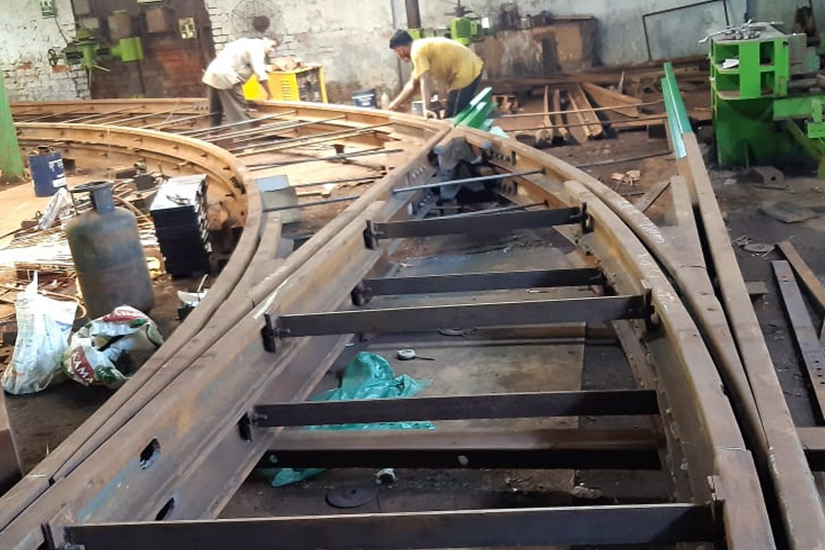
The width and height of the screenshot is (825, 550). Find the location of `industrial fan`. industrial fan is located at coordinates (248, 10).